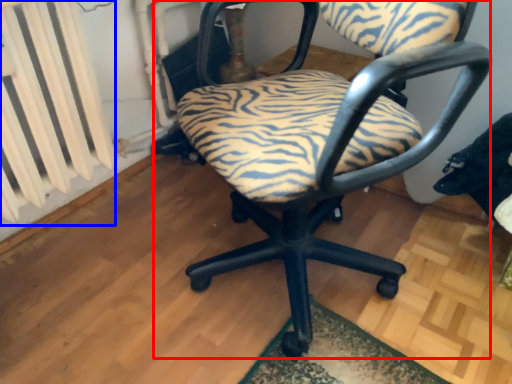
Question: Which object is further to the camera taking this photo, chair (highlighted by a red box) or radiator (highlighted by a blue box)?

Choices:
 (A) chair
 (B) radiator

Answer: (B)